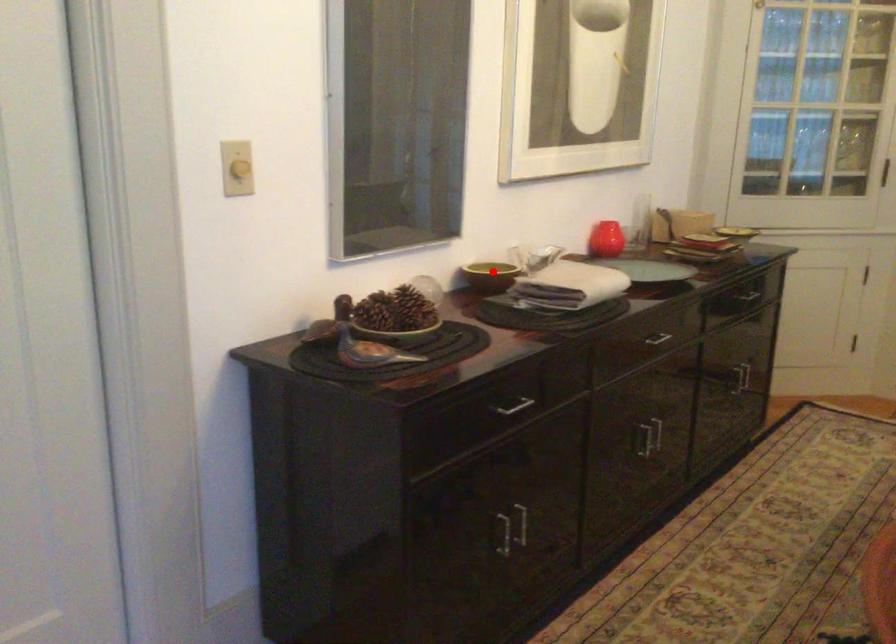
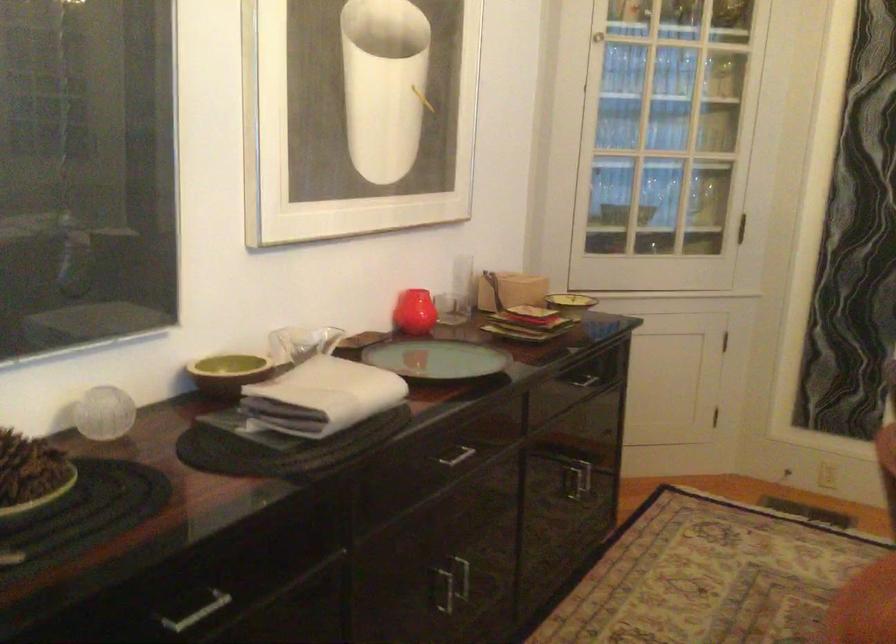
Question: I am providing you with two images of the same scene from different viewpoints. A red point is marked on the first image. At the location where the point appears in image 1, is it still visible in image 2?

Choices:
 (A) Yes
 (B) No

Answer: (A)